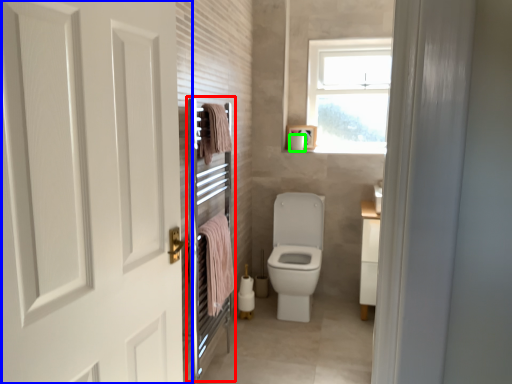
Question: Considering the real-world distances, which object is closest to screen door (highlighted by a red box)? door (highlighted by a blue box) or toilet paper (highlighted by a green box).

Choices:
 (A) door
 (B) toilet paper

Answer: (A)